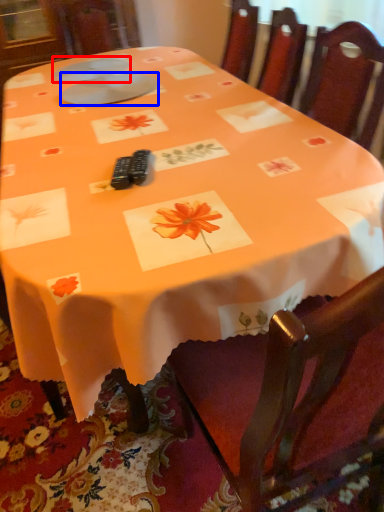
Question: Which point is closer to the camera, tableware (highlighted by a red box) or tableware (highlighted by a blue box)?

Choices:
 (A) tableware
 (B) tableware

Answer: (B)